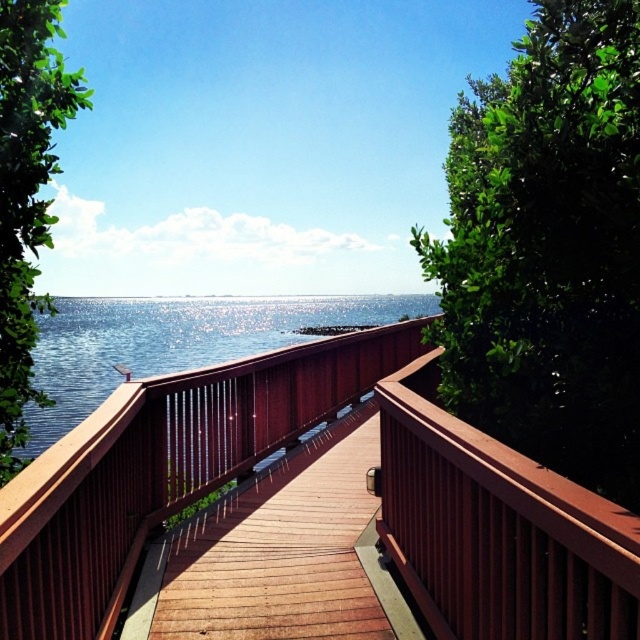
You are standing on the wooden walkway and want to determine which of the two points, point (67, 365) or point (4, 260), is closer to you. Which one should you choose?

Point (67, 365) is further to the viewer than point (4, 260), so the closer point to you is point (4, 260).